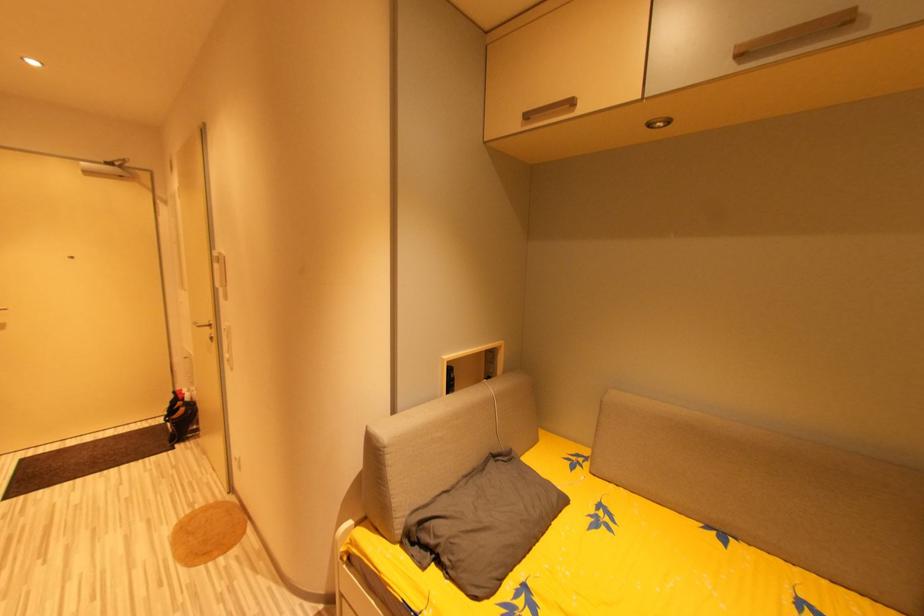
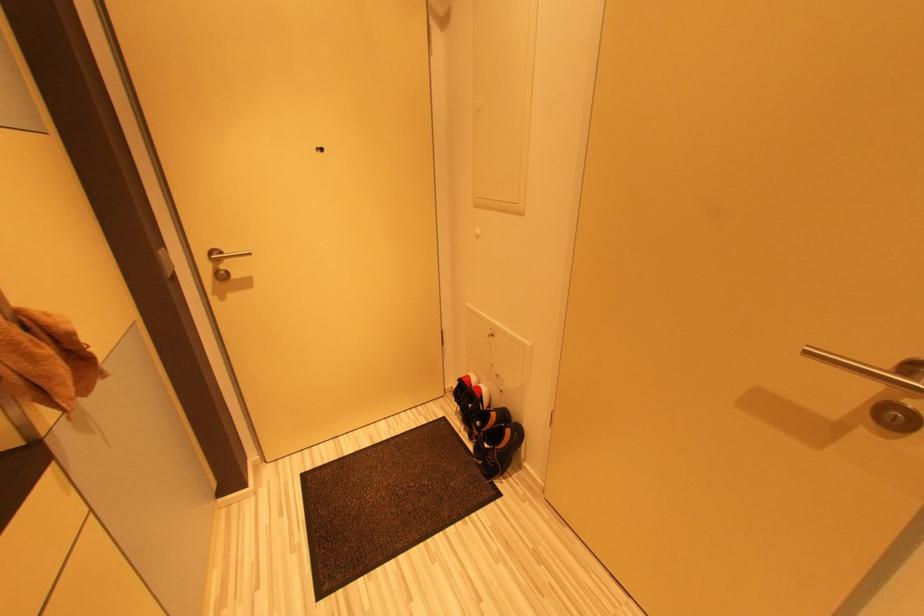
What movement of the cameraman would produce the second image?

The movement direction of the cameraman is left, forward.